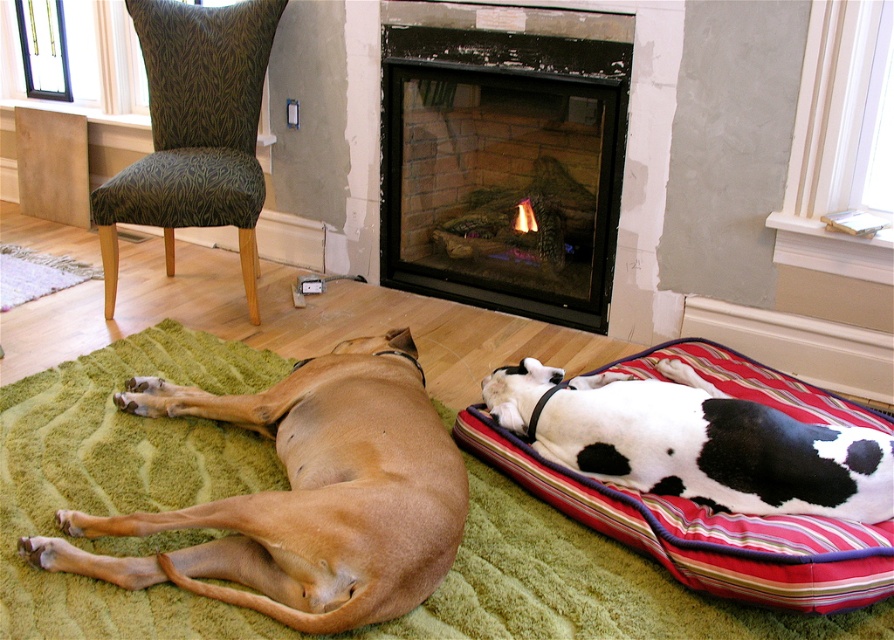
Can you confirm if black and white spotted dog at lower right is positioned above green textured fabric chair at upper left?

Actually, black and white spotted dog at lower right is below green textured fabric chair at upper left.

Consider the image. Can you confirm if black and white spotted dog at lower right is positioned below green textured fabric chair at upper left?

Yes.

Which is behind, point (540, 451) or point (190, 93)?

The point (190, 93) is behind.

I want to click on black and white spotted dog at lower right, so click(x=714, y=448).

Locate an element on the screen. The height and width of the screenshot is (640, 894). green textured rug at lower left is located at coordinates (124, 481).

From the picture: Is green textured rug at lower left positioned before brown smooth dog at lower left?

No, it is behind brown smooth dog at lower left.

This screenshot has height=640, width=894. In order to click on green textured rug at lower left in this screenshot , I will do `click(124, 481)`.

This screenshot has width=894, height=640. In order to click on green textured rug at lower left in this screenshot , I will do `click(124, 481)`.

Is brown smooth dog at lower left wider than brick fireplace at center?

Yes, brown smooth dog at lower left is wider than brick fireplace at center.

Does point (182, 401) come behind point (441, 256)?

No, it is not.

Who is more distant from viewer, (171, 573) or (431, 257)?

The point (431, 257) is behind.

Find the location of a particular element. Image resolution: width=894 pixels, height=640 pixels. brown smooth dog at lower left is located at coordinates (304, 496).